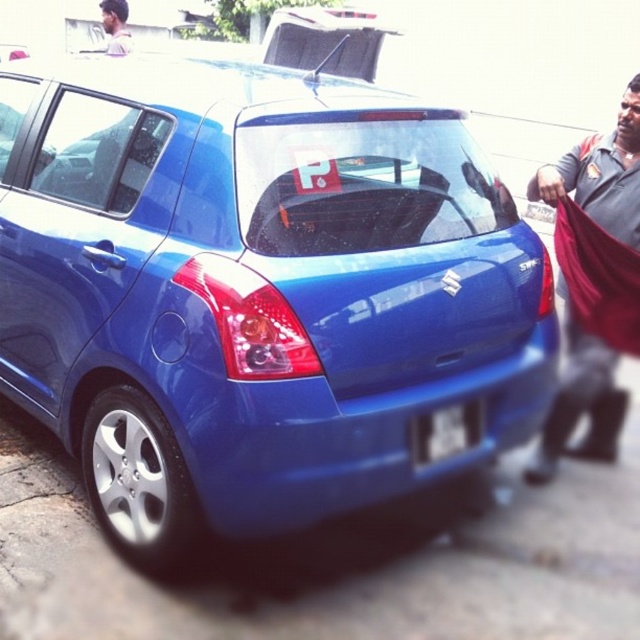
Which is more to the right, glossy blue hatchback at center or smooth skin face at upper left?

Positioned to the right is glossy blue hatchback at center.

Is glossy blue hatchback at center wider than smooth skin face at upper left?

Yes, glossy blue hatchback at center is wider than smooth skin face at upper left.

Does point (292, 436) come closer to viewer compared to point (124, 38)?

That is True.

Image resolution: width=640 pixels, height=640 pixels. I want to click on glossy blue hatchback at center, so click(x=253, y=291).

Measure the distance between point (442,432) and camera.

Point (442,432) is 8.45 feet away from camera.

Between white plastic license plate at center and smooth skin face at upper left, which one is positioned higher?

smooth skin face at upper left is higher up.

Is point (454, 433) positioned in front of point (124, 52)?

Yes.

Where is `white plastic license plate at center`? The height and width of the screenshot is (640, 640). white plastic license plate at center is located at coordinates (445, 432).

Between blue fabric at right and smooth skin face at upper left, which one is positioned higher?

smooth skin face at upper left is above.

Which is below, blue fabric at right or smooth skin face at upper left?

blue fabric at right is lower down.

Does point (584, 179) lie in front of point (106, 10)?

Yes, it is in front of point (106, 10).

Locate an element on the screen. The image size is (640, 640). blue fabric at right is located at coordinates (602, 173).